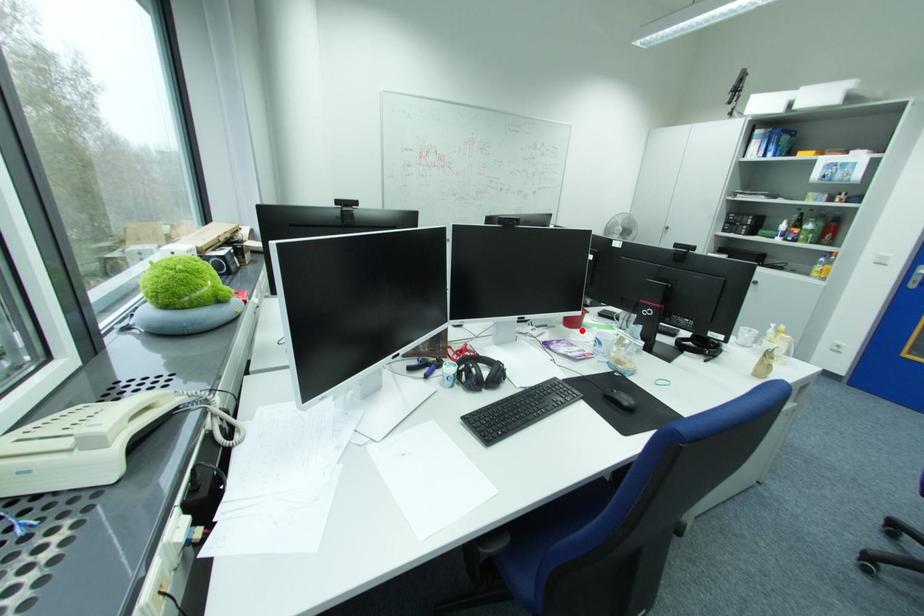
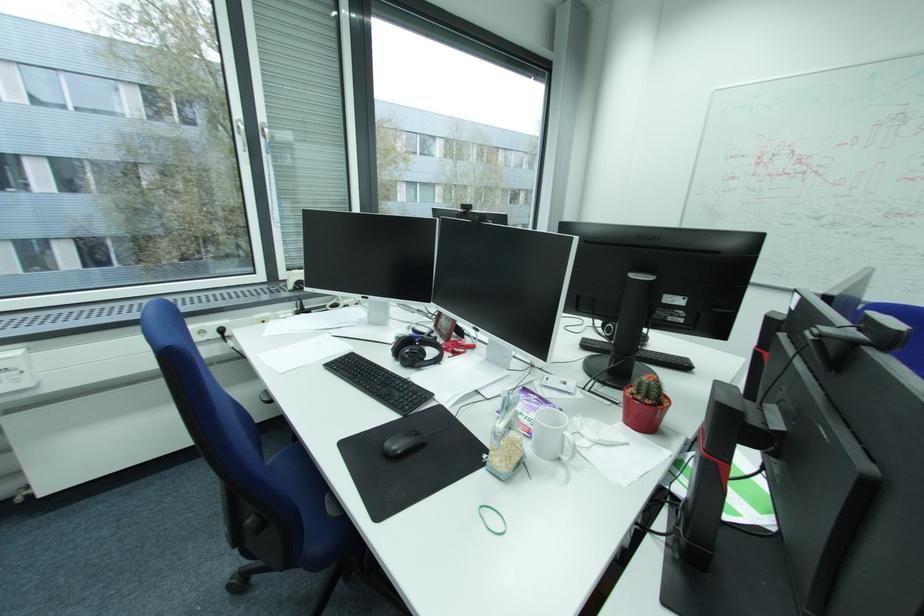
Find the pixel in the second image that matches the highlighted location in the first image.

(629, 424)